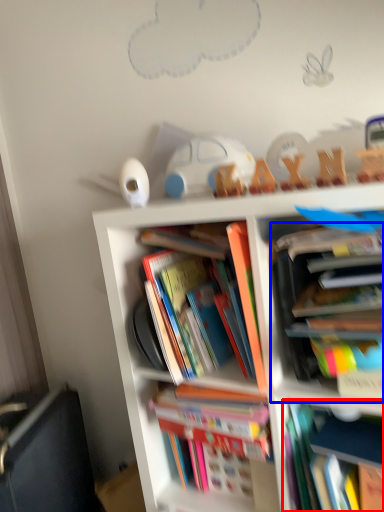
Question: Which object appears closest to the camera in this image, book (highlighted by a red box) or book (highlighted by a blue box)?

Choices:
 (A) book
 (B) book

Answer: (B)